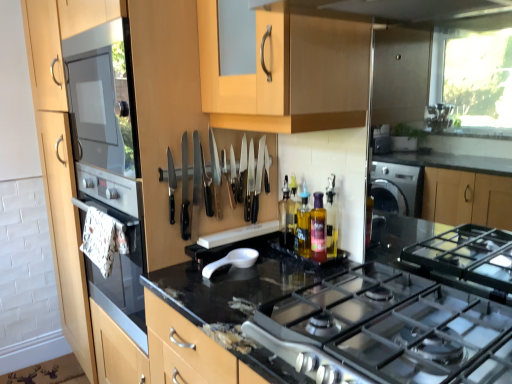
This screenshot has width=512, height=384. Identify the location of empty space that is ontop of black granite countertop at center (from a real-world perspective). (260, 282).